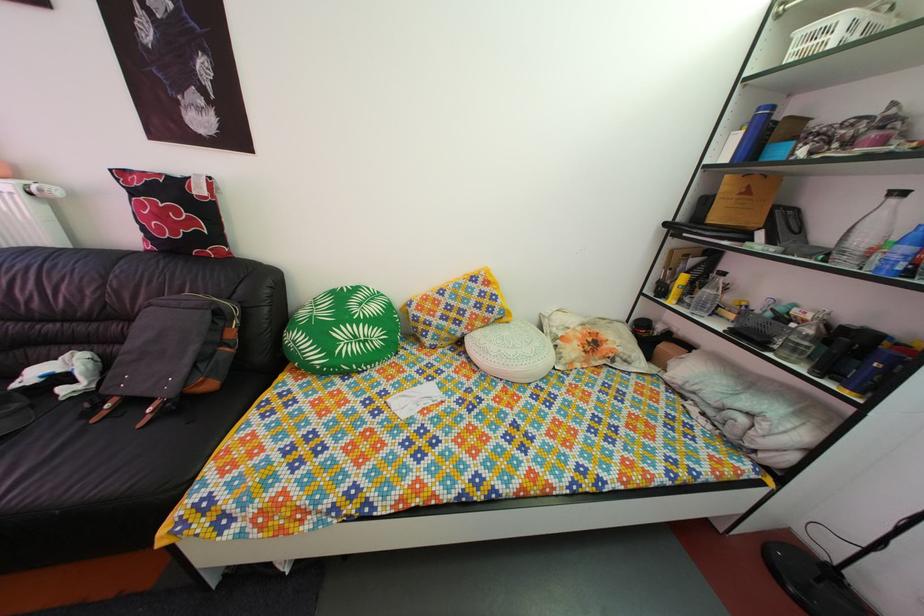
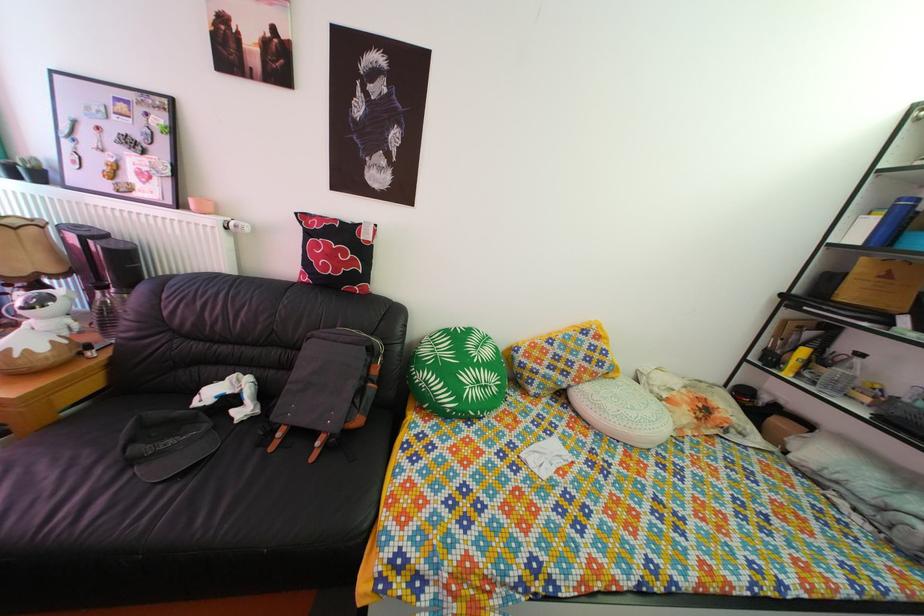
Find the pixel in the second image that matches [169,224] in the first image.

(338, 264)